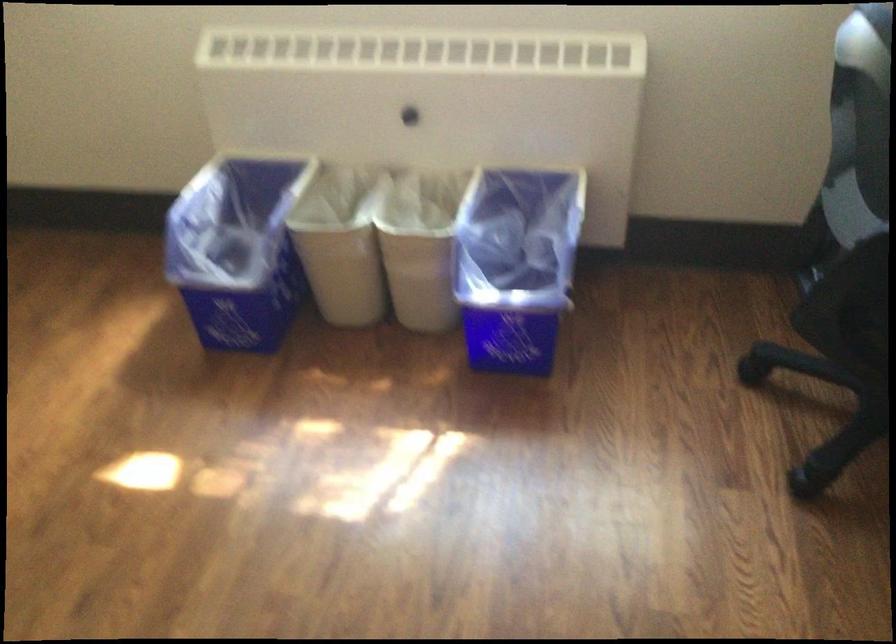
Describe the element at coordinates (848, 334) in the screenshot. I see `the chair sitting surface` at that location.